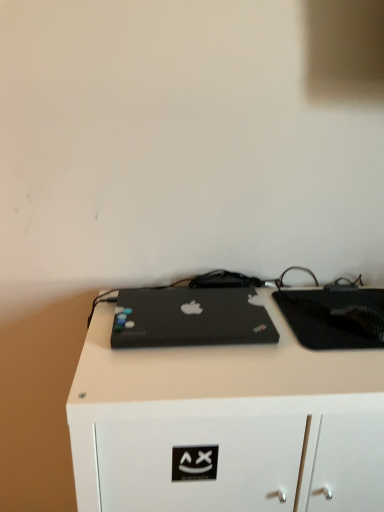
Question: From a real-world perspective, is black matte desk at center positioned under black matte laptop at center based on gravity?

Choices:
 (A) no
 (B) yes

Answer: (B)

Question: Considering the relative positions of black matte desk at center and black matte laptop at center in the image provided, is black matte desk at center to the left of black matte laptop at center from the viewer's perspective?

Choices:
 (A) yes
 (B) no

Answer: (B)

Question: From the image's perspective, does black matte desk at center appear higher than black matte laptop at center?

Choices:
 (A) yes
 (B) no

Answer: (B)

Question: Is black matte desk at center facing away from black matte laptop at center?

Choices:
 (A) no
 (B) yes

Answer: (A)

Question: Can you confirm if black matte desk at center is taller than black matte laptop at center?

Choices:
 (A) yes
 (B) no

Answer: (A)

Question: Considering the relative positions of black matte laptop at center and black matte desk at center in the image provided, is black matte laptop at center to the left or to the right of black matte desk at center?

Choices:
 (A) right
 (B) left

Answer: (B)

Question: Considering the positions of black matte laptop at center and black matte desk at center in the image, is black matte laptop at center wider or thinner than black matte desk at center?

Choices:
 (A) thin
 (B) wide

Answer: (A)

Question: Is black matte laptop at center bigger or smaller than black matte desk at center?

Choices:
 (A) small
 (B) big

Answer: (A)

Question: In terms of height, does black matte laptop at center look taller or shorter compared to black matte desk at center?

Choices:
 (A) tall
 (B) short

Answer: (B)

Question: Is black matte desk at center in front of or behind black matte laptop at center in the image?

Choices:
 (A) behind
 (B) front

Answer: (B)

Question: Is point (283, 446) positioned closer to the camera than point (274, 334)?

Choices:
 (A) closer
 (B) farther

Answer: (A)

Question: Looking at their shapes, would you say black matte desk at center is wider or thinner than black matte laptop at center?

Choices:
 (A) thin
 (B) wide

Answer: (B)

Question: Which is correct: black matte desk at center is inside black matte laptop at center, or outside of it?

Choices:
 (A) inside
 (B) outside

Answer: (B)

Question: Does point (289, 455) appear closer or farther from the camera than point (309, 289)?

Choices:
 (A) farther
 (B) closer

Answer: (B)

Question: Looking at the image, does black matte desk at center seem bigger or smaller compared to black matte tablet at center?

Choices:
 (A) big
 (B) small

Answer: (A)